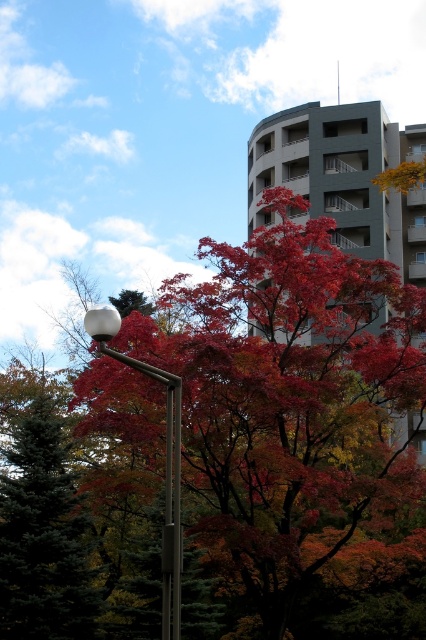
You are standing at the base of the tree with shiny red leaves at center and want to take a photo of them using a camera. The camera is placed on a tripod 1.5 meters tall. Can you safely reach the camera to adjust the settings without climbing the tripod?

The shiny red leaves at center and camera are 14.95 meters apart from each other. Since the distance is over 14 meters, you can easily reach the camera on the tripod without needing to climb it as the tripod is only 1.5 meters tall.

You are an artist planning to paint the autumn scene. You want to ensure the shiny red leaves at center and the gray concrete building at center are proportionally accurate. Which object should you paint smaller in your artwork?

The shiny red leaves at center should be painted smaller because they have a lesser width compared to the gray concrete building at center.